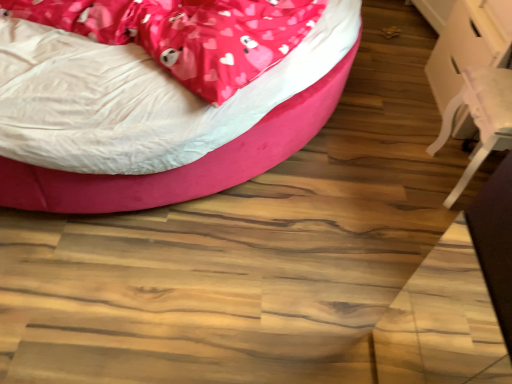
Question: Considering the relative positions of pink satin blanket at upper left and white plastic swivel chair at right in the image provided, is pink satin blanket at upper left behind white plastic swivel chair at right?

Choices:
 (A) no
 (B) yes

Answer: (A)

Question: Is pink satin blanket at upper left located outside white plastic swivel chair at right?

Choices:
 (A) no
 (B) yes

Answer: (B)

Question: From the image's perspective, is pink satin blanket at upper left on top of white plastic swivel chair at right?

Choices:
 (A) yes
 (B) no

Answer: (A)

Question: Does pink satin blanket at upper left have a smaller size compared to white plastic swivel chair at right?

Choices:
 (A) no
 (B) yes

Answer: (A)

Question: Does pink satin blanket at upper left have a lesser width compared to white plastic swivel chair at right?

Choices:
 (A) no
 (B) yes

Answer: (A)

Question: Is white glossy table at right to the left or to the right of velvet pink bed at upper left in the image?

Choices:
 (A) right
 (B) left

Answer: (A)

Question: Looking at their shapes, would you say white glossy table at right is wider or thinner than velvet pink bed at upper left?

Choices:
 (A) thin
 (B) wide

Answer: (A)

Question: Considering the positions of white glossy table at right and velvet pink bed at upper left in the image, is white glossy table at right taller or shorter than velvet pink bed at upper left?

Choices:
 (A) tall
 (B) short

Answer: (A)

Question: From a real-world perspective, is white glossy table at right above or below velvet pink bed at upper left?

Choices:
 (A) below
 (B) above

Answer: (A)

Question: Relative to white plastic swivel chair at right, is velvet pink bed at upper left in front or behind?

Choices:
 (A) front
 (B) behind

Answer: (A)

Question: Visually, is velvet pink bed at upper left positioned to the left or to the right of white plastic swivel chair at right?

Choices:
 (A) left
 (B) right

Answer: (A)

Question: From the image's perspective, relative to white plastic swivel chair at right, is velvet pink bed at upper left above or below?

Choices:
 (A) below
 (B) above

Answer: (B)

Question: From a real-world perspective, is velvet pink bed at upper left physically located above or below white plastic swivel chair at right?

Choices:
 (A) above
 (B) below

Answer: (A)

Question: From the image's perspective, is pink satin blanket at upper left above or below white glossy table at right?

Choices:
 (A) below
 (B) above

Answer: (B)

Question: From a real-world perspective, is pink satin blanket at upper left positioned above or below white glossy table at right?

Choices:
 (A) above
 (B) below

Answer: (A)